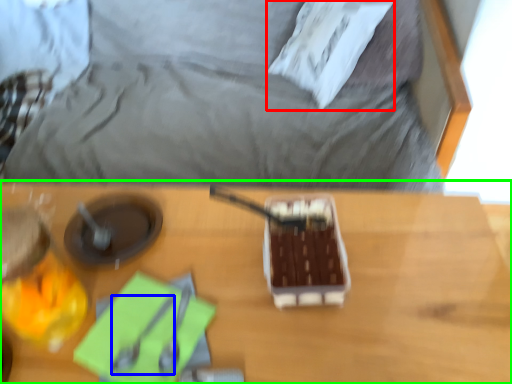
Question: Estimate the real-world distances between objects in this image. Which object is closer to pillow (highlighted by a red box), utensil (highlighted by a blue box) or table (highlighted by a green box)?

Choices:
 (A) utensil
 (B) table

Answer: (B)